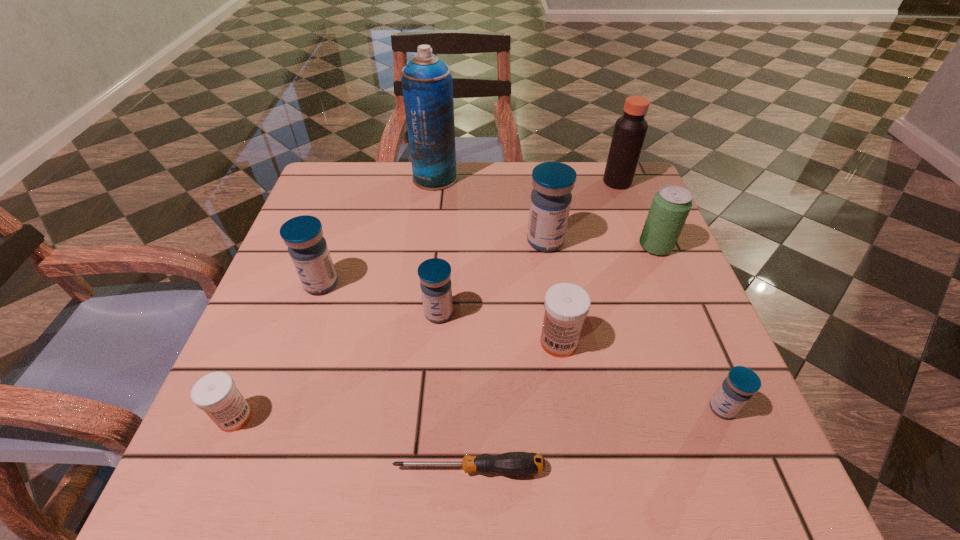
Image resolution: width=960 pixels, height=540 pixels. In order to click on free location located 0.290m on the left of the farthest medicine in this screenshot , I will do `click(398, 241)`.

You are a GUI agent. You are given a task and a screenshot of the screen. Output one action in this format:
    pyautogui.click(x=<x>, y=<y>)
    Task: Click on the free space located 0.230m on the right of the leftmost blue medicine
    
    Given the screenshot: What is the action you would take?
    pyautogui.click(x=450, y=284)

Image resolution: width=960 pixels, height=540 pixels. Identify the location of vacant region located on the front of the soda. (670, 281).

What are the coordinates of `vacant space situated 0.360m on the back of the sixth farthest object` in the screenshot? It's located at click(x=448, y=195).

The width and height of the screenshot is (960, 540). In order to click on vacant space located on the left of the right white medicine in this screenshot , I will do coord(500,342).

Locate an element on the screen. This screenshot has width=960, height=540. vacant space located 0.300m on the back of the nearer white medicine is located at coordinates click(295, 272).

Find the location of `free space located on the back of the rightmost medicine`. free space located on the back of the rightmost medicine is located at coordinates (662, 262).

The height and width of the screenshot is (540, 960). I want to click on vacant area located 0.240m on the back of the screwdriver, so click(471, 329).

Locate an element on the screen. aerosol can present at the far edge is located at coordinates (427, 84).

Where is `vinegar that is at the far edge`? vinegar that is at the far edge is located at coordinates (630, 129).